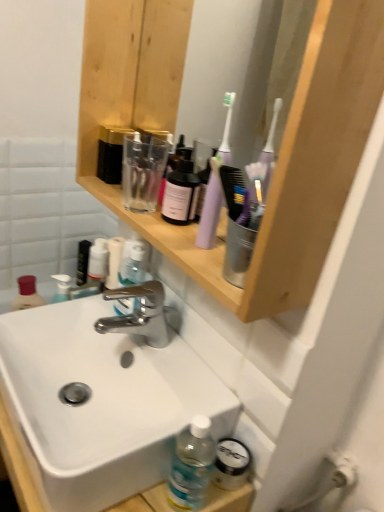
Question: Is black matte tube at upper left turned away from transparent plastic bottle at upper center?

Choices:
 (A) no
 (B) yes

Answer: (A)

Question: Is the position of black matte tube at upper left less distant than that of transparent plastic bottle at upper center?

Choices:
 (A) yes
 (B) no

Answer: (B)

Question: Is black matte tube at upper left smaller than transparent plastic bottle at upper center?

Choices:
 (A) no
 (B) yes

Answer: (A)

Question: Is black matte tube at upper left far from transparent plastic bottle at upper center?

Choices:
 (A) no
 (B) yes

Answer: (A)

Question: From the image's perspective, is black matte tube at upper left on transparent plastic bottle at upper center?

Choices:
 (A) no
 (B) yes

Answer: (A)

Question: Can you confirm if black matte tube at upper left is shorter than transparent plastic bottle at upper center?

Choices:
 (A) no
 (B) yes

Answer: (A)

Question: Considering the relative sizes of black matte tube at upper left and wooden shelf at upper center in the image provided, is black matte tube at upper left taller than wooden shelf at upper center?

Choices:
 (A) no
 (B) yes

Answer: (A)

Question: Is black matte tube at upper left thinner than wooden shelf at upper center?

Choices:
 (A) yes
 (B) no

Answer: (A)

Question: Could you tell me if black matte tube at upper left is turned towards wooden shelf at upper center?

Choices:
 (A) no
 (B) yes

Answer: (A)

Question: Considering the relative positions of black matte tube at upper left and wooden shelf at upper center in the image provided, is black matte tube at upper left behind wooden shelf at upper center?

Choices:
 (A) yes
 (B) no

Answer: (A)

Question: Can you confirm if black matte tube at upper left is bigger than wooden shelf at upper center?

Choices:
 (A) yes
 (B) no

Answer: (B)

Question: Is black matte tube at upper left not close to wooden shelf at upper center?

Choices:
 (A) no
 (B) yes

Answer: (A)

Question: Does polished chrome faucet at center turn towards purple plastic toothbrush at upper center?

Choices:
 (A) yes
 (B) no

Answer: (B)